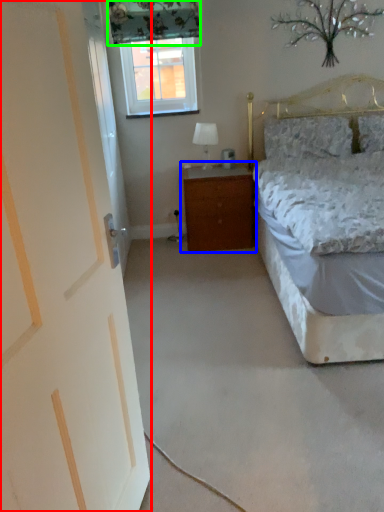
Question: Based on their relative distances, which object is farther from door (highlighted by a red box)? Choose from nightstand (highlighted by a blue box) and curtain (highlighted by a green box).

Choices:
 (A) nightstand
 (B) curtain

Answer: (B)